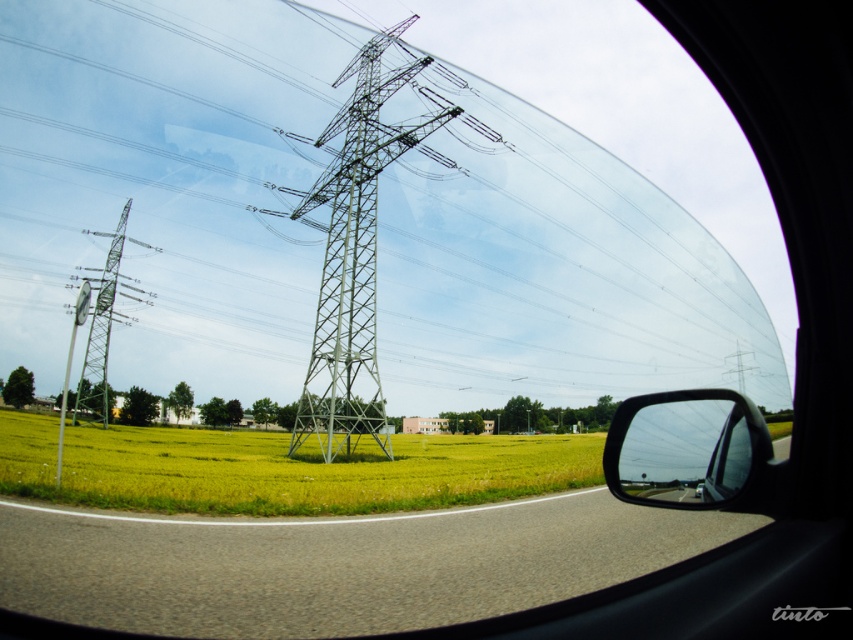
Question: Which of these objects is positioned farthest from the green grassy field at center?

Choices:
 (A) shiny black mirror at right
 (B) green metallic tower at center

Answer: (A)

Question: Can you confirm if green metallic tower at center is positioned above shiny black mirror at right?

Choices:
 (A) yes
 (B) no

Answer: (A)

Question: Is shiny black mirror at right to the right of green metallic tower at left from the viewer's perspective?

Choices:
 (A) yes
 (B) no

Answer: (A)

Question: Which of the following is the closest to the observer?

Choices:
 (A) green metallic tower at center
 (B) green metallic tower at left
 (C) shiny black mirror at right

Answer: (C)

Question: Which object is farther from the camera taking this photo?

Choices:
 (A) green metallic tower at left
 (B) shiny black mirror at right
 (C) green metallic tower at center
 (D) green grassy field at center

Answer: (A)

Question: Is green metallic tower at center thinner than green metallic tower at left?

Choices:
 (A) yes
 (B) no

Answer: (A)